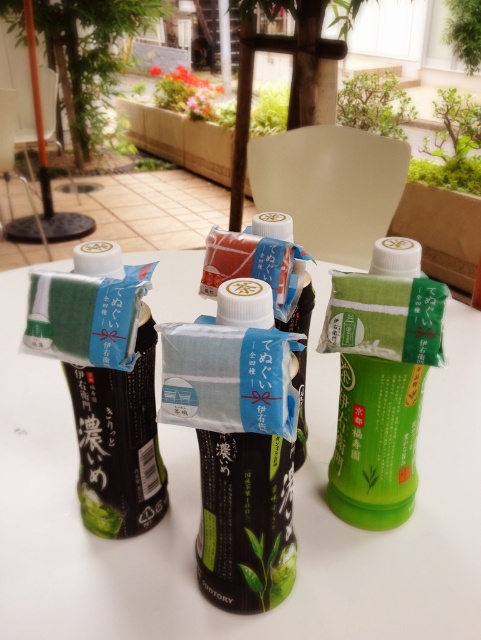
Question: Based on their relative distances, which object is nearer to the matte black bottle at left?

Choices:
 (A) green matte carton at center
 (B) matte black bottle at center

Answer: (B)

Question: Can you confirm if green matte plastic bottles at center is positioned below matte black bottle at left?

Choices:
 (A) no
 (B) yes

Answer: (A)

Question: Which point is closer to the camera?

Choices:
 (A) (97, 259)
 (B) (379, 472)
 (C) (206, 497)
 (D) (437, 502)

Answer: (C)

Question: Among these points, which one is farthest from the camera?

Choices:
 (A) (5, 468)
 (B) (141, 449)
 (C) (407, 237)
 (D) (253, 492)

Answer: (A)

Question: Does green matte carton at center appear under matte black bottle at center?

Choices:
 (A) no
 (B) yes

Answer: (A)

Question: Does matte black bottle at center appear on the right side of matte black bottle at left?

Choices:
 (A) yes
 (B) no

Answer: (A)